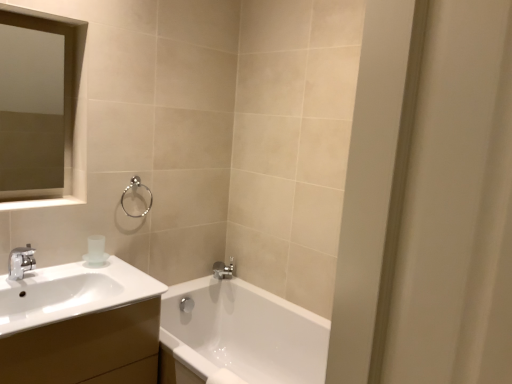
Where is `matte glass medicine cabinet at upper left`? Image resolution: width=512 pixels, height=384 pixels. matte glass medicine cabinet at upper left is located at coordinates (73, 124).

What is the approximate width of polished chrome faucet at lower center?

The width of polished chrome faucet at lower center is 11.73 centimeters.

Describe the element at coordinates (81, 345) in the screenshot. This screenshot has width=512, height=384. I see `white glossy cabinet at left` at that location.

At what (x,y) coordinates should I click in order to perform the action: click on transparent frosted glass cup at upper left. Please return your answer as a coordinate pair (x, y). This screenshot has height=384, width=512. Looking at the image, I should click on (96, 251).

Consider the image. Considering the sizes of white glossy cabinet at left and transparent frosted glass cup at upper left in the image, is white glossy cabinet at left wider or thinner than transparent frosted glass cup at upper left?

white glossy cabinet at left is wider than transparent frosted glass cup at upper left.

How different are the orientations of white glossy cabinet at left and transparent frosted glass cup at upper left in degrees?

The angle between the facing direction of white glossy cabinet at left and the facing direction of transparent frosted glass cup at upper left is 0.14 degrees.

How far apart are white glossy cabinet at left and transparent frosted glass cup at upper left?

white glossy cabinet at left is 16.90 inches away from transparent frosted glass cup at upper left.

Considering the sizes of objects white glossy cabinet at left and transparent frosted glass cup at upper left in the image provided, who is taller, white glossy cabinet at left or transparent frosted glass cup at upper left?

Standing taller between the two is white glossy cabinet at left.

Does white glossy balustrade at upper left have a smaller size compared to white glossy cabinet at left?

Yes, white glossy balustrade at upper left is smaller than white glossy cabinet at left.

From a real-world perspective, relative to white glossy cabinet at left, is white glossy balustrade at upper left vertically above or below?

white glossy balustrade at upper left is above white glossy cabinet at left.

Are white glossy balustrade at upper left and matte glass medicine cabinet at upper left beside each other?

No, white glossy balustrade at upper left is not making contact with matte glass medicine cabinet at upper left.

Who is more distant, white glossy balustrade at upper left or matte glass medicine cabinet at upper left?

matte glass medicine cabinet at upper left.

From a real-world perspective, does white glossy balustrade at upper left sit lower than matte glass medicine cabinet at upper left?

Yes.

Is white glossy balustrade at upper left oriented away from matte glass medicine cabinet at upper left?

No, white glossy balustrade at upper left is not facing the opposite direction of matte glass medicine cabinet at upper left.

Is transparent frosted glass cup at upper left not near white glossy balustrade at upper left?

No, transparent frosted glass cup at upper left is in close proximity to white glossy balustrade at upper left.

Is point (85, 257) positioned behind point (39, 201)?

Yes.

From the picture: How distant is transparent frosted glass cup at upper left from white glossy balustrade at upper left?

9.32 inches.

You are a GUI agent. You are given a task and a screenshot of the screen. Output one action in this format:
    pyautogui.click(x=<x>, y=<y>)
    Task: Click on the toiletry below the white glossy balustrade at upper left (from a real-world perspective)
    
    Given the screenshot: What is the action you would take?
    pyautogui.click(x=96, y=251)

Which object is thinner, polished chrome faucet at lower center or transparent frosted glass cup at upper left?

With smaller width is transparent frosted glass cup at upper left.

Is polished chrome faucet at lower center to the left of transparent frosted glass cup at upper left from the viewer's perspective?

In fact, polished chrome faucet at lower center is to the right of transparent frosted glass cup at upper left.

Where is `tap to the right of transparent frosted glass cup at upper left`? The height and width of the screenshot is (384, 512). tap to the right of transparent frosted glass cup at upper left is located at coordinates (224, 269).

Is polished chrome faucet at lower center located outside transparent frosted glass cup at upper left?

Yes, polished chrome faucet at lower center is outside of transparent frosted glass cup at upper left.

Does polished chrome faucet at lower center come behind matte glass medicine cabinet at upper left?

Yes, the depth of polished chrome faucet at lower center is greater than that of matte glass medicine cabinet at upper left.

Is polished chrome faucet at lower center facing away from matte glass medicine cabinet at upper left?

polished chrome faucet at lower center does not have its back to matte glass medicine cabinet at upper left.

Are polished chrome faucet at lower center and matte glass medicine cabinet at upper left located far from each other?

polished chrome faucet at lower center is far away from matte glass medicine cabinet at upper left.

Is polished chrome faucet at lower center spatially inside matte glass medicine cabinet at upper left, or outside of it?

polished chrome faucet at lower center is outside matte glass medicine cabinet at upper left.

Is matte glass medicine cabinet at upper left not inside white glossy balustrade at upper left?

That's correct, matte glass medicine cabinet at upper left is outside of white glossy balustrade at upper left.

Considering the relative sizes of matte glass medicine cabinet at upper left and white glossy balustrade at upper left in the image provided, is matte glass medicine cabinet at upper left taller than white glossy balustrade at upper left?

Yes, matte glass medicine cabinet at upper left is taller than white glossy balustrade at upper left.

Is matte glass medicine cabinet at upper left next to white glossy balustrade at upper left and touching it?

No, matte glass medicine cabinet at upper left is not in contact with white glossy balustrade at upper left.

In the scene shown: Is matte glass medicine cabinet at upper left oriented away from white glossy balustrade at upper left?

No, white glossy balustrade at upper left is not at the back of matte glass medicine cabinet at upper left.

At what (x,y) coordinates should I click in order to perform the action: click on toiletry lying above the white glossy cabinet at left (from the image's perspective). Please return your answer as a coordinate pair (x, y). Looking at the image, I should click on (96, 251).

The height and width of the screenshot is (384, 512). Identify the location of balustrade behind the white glossy cabinet at left. (41, 203).

Estimate the real-world distances between objects in this image. Which object is closer to white glossy cabinet at left, transparent frosted glass cup at upper left or white glossy balustrade at upper left?

transparent frosted glass cup at upper left is positioned closer to the anchor white glossy cabinet at left.

Based on the photo, when comparing their distances from white glossy balustrade at upper left, does matte glass medicine cabinet at upper left or satin silver towel ring at upper center seem closer?

Among the two, matte glass medicine cabinet at upper left is located nearer to white glossy balustrade at upper left.

From the image, which object appears to be farther from transparent frosted glass cup at upper left, polished chrome faucet at lower center or white glossy balustrade at upper left?

Among the two, polished chrome faucet at lower center is located further to transparent frosted glass cup at upper left.

When comparing their distances from transparent frosted glass cup at upper left, does white glossy cabinet at left or white glossy balustrade at upper left seem further?

white glossy cabinet at left is further to transparent frosted glass cup at upper left.

Looking at the image, which one is located further to matte glass medicine cabinet at upper left, white glossy cabinet at left or satin silver towel ring at upper center?

white glossy cabinet at left lies further to matte glass medicine cabinet at upper left than the other object.

Based on their spatial positions, is matte glass medicine cabinet at upper left or transparent frosted glass cup at upper left further from white glossy balustrade at upper left?

transparent frosted glass cup at upper left lies further to white glossy balustrade at upper left than the other object.

Considering their positions, is matte glass medicine cabinet at upper left positioned closer to satin silver towel ring at upper center than polished chrome faucet at lower center?

Based on the image, matte glass medicine cabinet at upper left appears to be nearer to satin silver towel ring at upper center.

When comparing their distances from matte glass medicine cabinet at upper left, does white glossy cabinet at left or transparent frosted glass cup at upper left seem closer?

Among the two, transparent frosted glass cup at upper left is located nearer to matte glass medicine cabinet at upper left.

At what (x,y) coordinates should I click in order to perform the action: click on shower positioned between white glossy cabinet at left and polished chrome faucet at lower center from near to far. Please return your answer as a coordinate pair (x, y). Looking at the image, I should click on (136, 186).

Locate an element on the screen. balustrade between matte glass medicine cabinet at upper left and white glossy cabinet at left from top to bottom is located at coordinates coord(41,203).

At what (x,y) coordinates should I click in order to perform the action: click on balustrade between white glossy cabinet at left and polished chrome faucet at lower center along the z-axis. Please return your answer as a coordinate pair (x, y). Looking at the image, I should click on (41, 203).

Image resolution: width=512 pixels, height=384 pixels. I want to click on shower located between white glossy balustrade at upper left and polished chrome faucet at lower center in the left-right direction, so click(x=136, y=186).